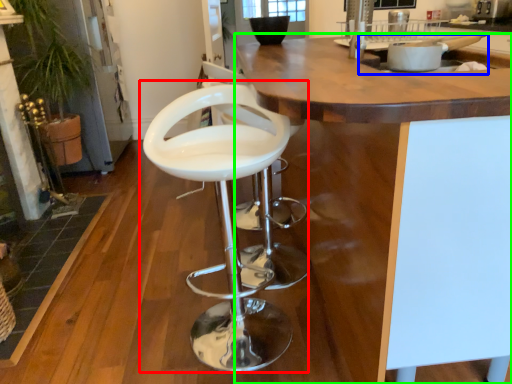
Question: Estimate the real-world distances between objects in this image. Which object is closer to chair (highlighted by a red box), sink (highlighted by a blue box) or countertop (highlighted by a green box)?

Choices:
 (A) sink
 (B) countertop

Answer: (B)